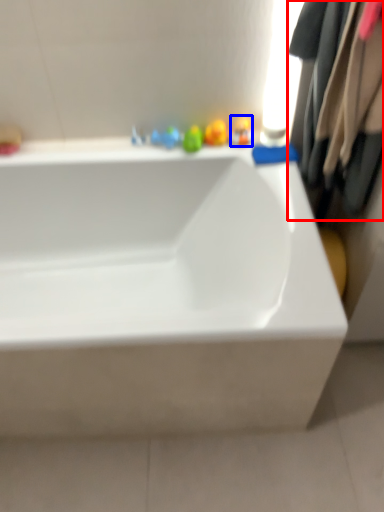
Question: Among these objects, which one is nearest to the camera, clothing (highlighted by a red box) or toy (highlighted by a blue box)?

Choices:
 (A) clothing
 (B) toy

Answer: (A)